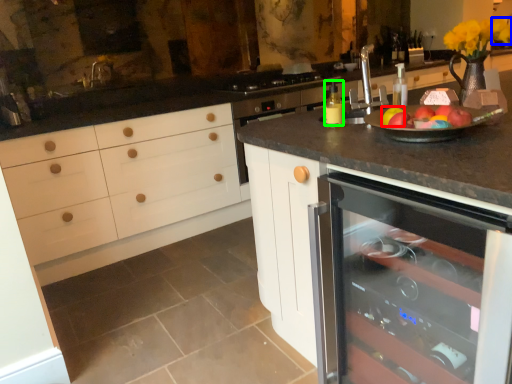
Question: Which object is positioned farthest from apple (highlighted by a red box)? Select from flower (highlighted by a blue box) and bottle (highlighted by a green box).

Choices:
 (A) flower
 (B) bottle

Answer: (A)